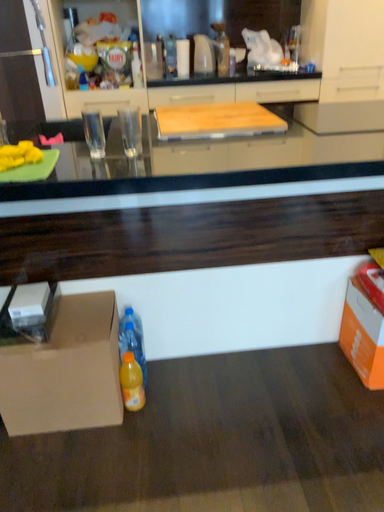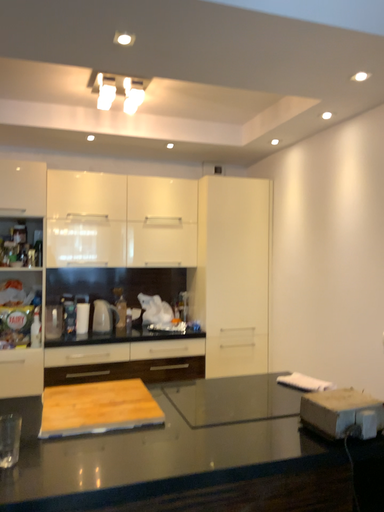
Question: How did the camera likely rotate when shooting the video?

Choices:
 (A) rotated downward
 (B) rotated upward

Answer: (B)